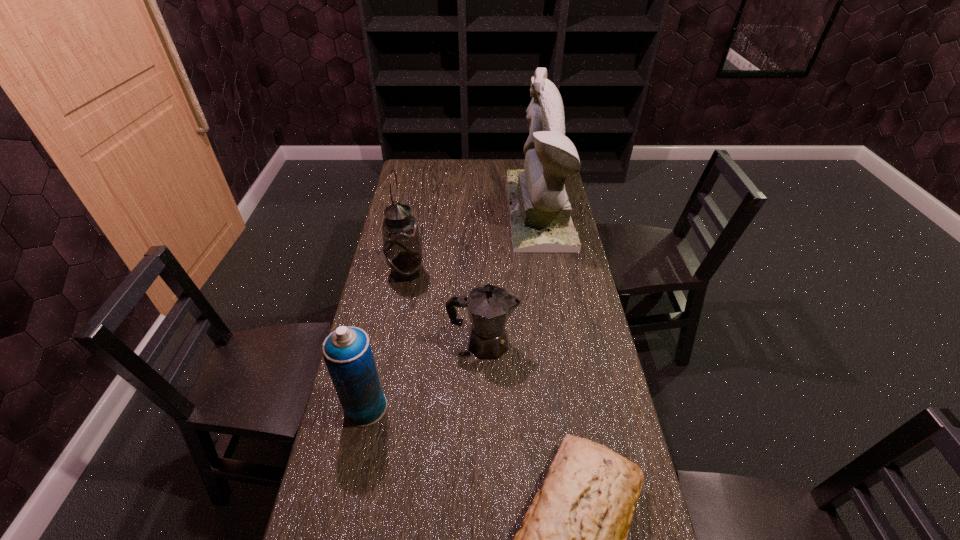
Where is `the farthest object`? the farthest object is located at coordinates (540, 212).

Where is `sculpture`? sculpture is located at coordinates (540, 212).

At what (x,y) coordinates should I click in order to perform the action: click on the fourth nearest object. Please return your answer as a coordinate pair (x, y). Looking at the image, I should click on (401, 246).

Where is `oil lamp`? The width and height of the screenshot is (960, 540). oil lamp is located at coordinates (401, 246).

At what (x,y) coordinates should I click in order to perform the action: click on aerosol can. Please return your answer as a coordinate pair (x, y). The image size is (960, 540). Looking at the image, I should click on (347, 353).

At what (x,y) coordinates should I click in order to perform the action: click on the third tallest object. Please return your answer as a coordinate pair (x, y). The width and height of the screenshot is (960, 540). Looking at the image, I should click on (347, 353).

What are the coordinates of `the third nearest object` in the screenshot? It's located at (489, 307).

Image resolution: width=960 pixels, height=540 pixels. Identify the location of the second shortest object. (489, 307).

Identify the location of free spot located on the base of the tallest object. (444, 210).

This screenshot has height=540, width=960. In order to click on vacant space located 0.140m on the base of the tallest object in this screenshot , I will do `click(477, 210)`.